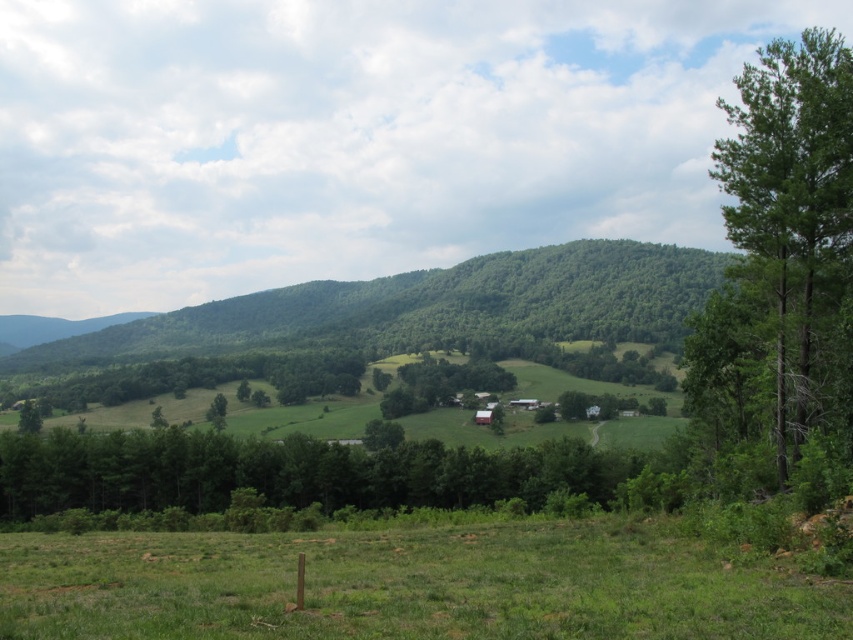
You are a bird looking for a place to perch. You see the green leafy tree at right and the green matte tree at center. Which tree is higher up in the image?

The green leafy tree at right is positioned over the green matte tree at center, so it is higher up in the image.

You are planning to set up a tent for a camping trip and need to choose between the green grassy field at lower center and the green leafy mountain at center. Which location offers more space for setting up your tent?

The green grassy field at lower center is thinner than the green leafy mountain at center, so the mountain offers more space for setting up the tent.

You are standing in the middle of the grassy field and see both the green leafy mountain at center and the green leafy tree at center. Which one is more to the left?

The green leafy mountain at center is more to the left since it is positioned on the left side of the green leafy tree at center.